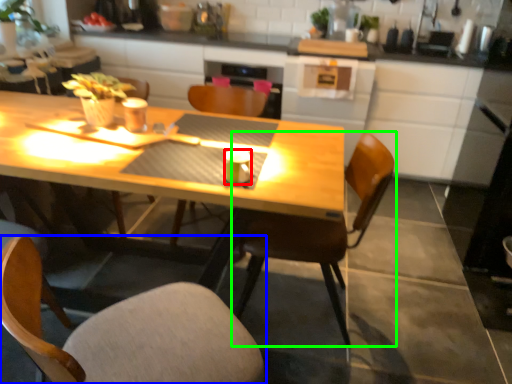
Question: Which is nearer to the coffee cup (highlighted by a red box)? chair (highlighted by a blue box) or chair (highlighted by a green box).

Choices:
 (A) chair
 (B) chair

Answer: (B)